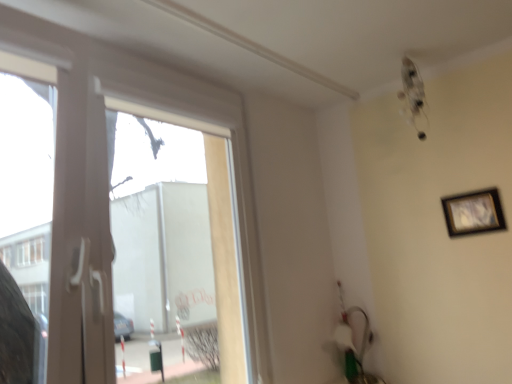
Find the location of a particular element. This screenshot has width=512, height=384. black matte picture frame at upper right is located at coordinates (473, 213).

What do you see at coordinates (473, 213) in the screenshot? The height and width of the screenshot is (384, 512). I see `black matte picture frame at upper right` at bounding box center [473, 213].

What do you see at coordinates (105, 166) in the screenshot? Image resolution: width=512 pixels, height=384 pixels. I see `transparent glass window at left` at bounding box center [105, 166].

I want to click on transparent glass window at left, so click(x=105, y=166).

Identify the location of black matte picture frame at upper right. (473, 213).

Considering the positions of objects black matte picture frame at upper right and transparent glass window at left in the image provided, who is more to the right, black matte picture frame at upper right or transparent glass window at left?

black matte picture frame at upper right.

Does black matte picture frame at upper right lie behind transparent glass window at left?

Yes, black matte picture frame at upper right is behind transparent glass window at left.

Does point (459, 222) lie in front of point (73, 298)?

No, it is not.

From the image's perspective, which one is positioned lower, black matte picture frame at upper right or transparent glass window at left?

transparent glass window at left appears lower in the image.

From a real-world perspective, who is located higher, black matte picture frame at upper right or transparent glass window at left?

transparent glass window at left.

Which object is wider, black matte picture frame at upper right or transparent glass window at left?

Wider between the two is transparent glass window at left.

Does black matte picture frame at upper right have a greater height compared to transparent glass window at left?

No.

Considering the relative sizes of black matte picture frame at upper right and transparent glass window at left in the image provided, is black matte picture frame at upper right bigger than transparent glass window at left?

No, black matte picture frame at upper right is not bigger than transparent glass window at left.

Is transparent glass window at left located within black matte picture frame at upper right?

No, black matte picture frame at upper right does not contain transparent glass window at left.

Are black matte picture frame at upper right and transparent glass window at left located far from each other?

Indeed, black matte picture frame at upper right is not near transparent glass window at left.

Is black matte picture frame at upper right oriented away from transparent glass window at left?

No, black matte picture frame at upper right's orientation is not away from transparent glass window at left.

Measure the distance from black matte picture frame at upper right to transparent glass window at left.

The distance of black matte picture frame at upper right from transparent glass window at left is 3.90 feet.

In the image, there is a transparent glass window at left. Identify the location of picture frame below it (from a real-world perspective). This screenshot has width=512, height=384. (473, 213).

Which object is positioned more to the left, transparent glass window at left or black matte picture frame at upper right?

Positioned to the left is transparent glass window at left.

Between transparent glass window at left and black matte picture frame at upper right, which one is positioned in front?

transparent glass window at left is in front.

Which is nearer, (98, 204) or (488, 222)?

Point (98, 204)

From the image's perspective, is transparent glass window at left located above or below black matte picture frame at upper right?

Based on their image positions, transparent glass window at left is located beneath black matte picture frame at upper right.

From a real-world perspective, which object stands above the other?

transparent glass window at left is physically above.

Considering the sizes of objects transparent glass window at left and black matte picture frame at upper right in the image provided, who is wider, transparent glass window at left or black matte picture frame at upper right?

With larger width is transparent glass window at left.

Who is shorter, transparent glass window at left or black matte picture frame at upper right?

black matte picture frame at upper right.

Based on the photo, which of these two, transparent glass window at left or black matte picture frame at upper right, is bigger?

Bigger between the two is transparent glass window at left.

Would you say black matte picture frame at upper right is part of transparent glass window at left's contents?

No, black matte picture frame at upper right is not surrounded by transparent glass window at left.

Can you see transparent glass window at left touching black matte picture frame at upper right?

No, transparent glass window at left is not making contact with black matte picture frame at upper right.

Is transparent glass window at left facing towards black matte picture frame at upper right?

No, transparent glass window at left is not facing towards black matte picture frame at upper right.

Measure the distance from transparent glass window at left to black matte picture frame at upper right.

transparent glass window at left and black matte picture frame at upper right are 3.90 feet apart from each other.

Locate an element on the screen. The width and height of the screenshot is (512, 384). picture frame that is behind the transparent glass window at left is located at coordinates (473, 213).

Where is `window that is on the left side of black matte picture frame at upper right`? Image resolution: width=512 pixels, height=384 pixels. window that is on the left side of black matte picture frame at upper right is located at coordinates (105, 166).

You are a GUI agent. You are given a task and a screenshot of the screen. Output one action in this format:
    pyautogui.click(x=<x>, y=<y>)
    Task: Click on the picture frame below the transparent glass window at left (from a real-world perspective)
    
    Given the screenshot: What is the action you would take?
    pyautogui.click(x=473, y=213)